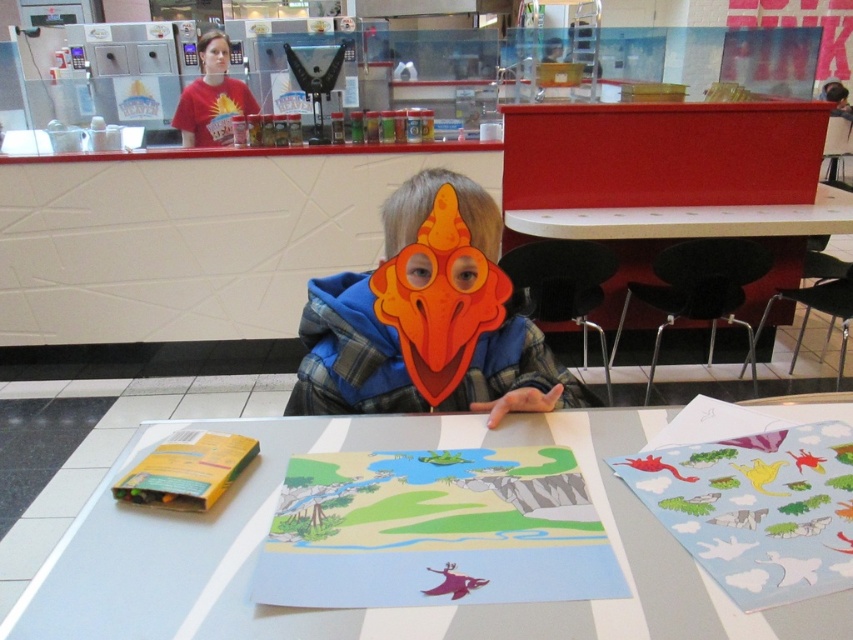
You are a parent trying to place a small toy on the table. The toy requires a surface that is taller than the orange paper mask at center. Can you place it on the white glossy table at center?

The white glossy table at center has a lesser height compared to orange paper mask at center, so the toy cannot be placed there as it requires a taller surface than the orange paper mask at center.

You are a guest at a birthday party and see the white glossy table at center and the orange paper mask at center. Which object is positioned to the right of the other?

The white glossy table at center is to the right of the orange paper mask at center.

You are standing in front of the table with markers and artwork. There are two points marked on the table. Which point, point 1 at coordinates (715, 627) or point 2 at coordinates (498, 298), is closer to you?

Point 1 at coordinates (715, 627) is closer to the viewer than point 2 at coordinates (498, 298).